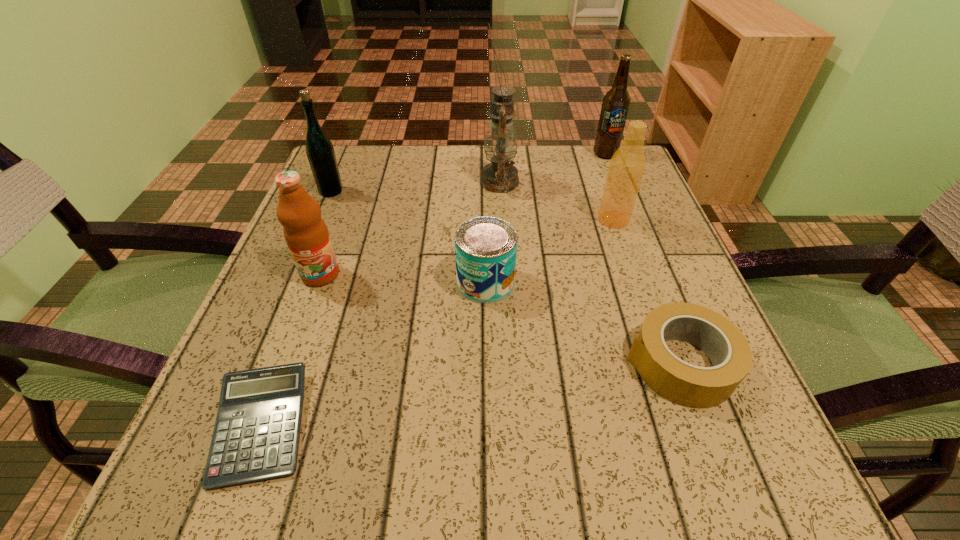
Find the location of `the tallest object`. the tallest object is located at coordinates (501, 142).

Where is `the farthest object`? The height and width of the screenshot is (540, 960). the farthest object is located at coordinates (616, 102).

Where is `the leftmost beer bottle`? the leftmost beer bottle is located at coordinates (320, 152).

You are a GUI agent. You are given a task and a screenshot of the screen. Output one action in this format:
    pyautogui.click(x=<x>, y=<y>)
    Task: Click on the fourth farthest object
    
    Given the screenshot: What is the action you would take?
    pyautogui.click(x=627, y=166)

The height and width of the screenshot is (540, 960). Identify the location of fruit juice. (306, 234).

In order to click on the sixth tallest object in this screenshot , I will do `click(485, 247)`.

Find the location of a particular element. The image size is (960, 540). the seventh tallest object is located at coordinates (685, 384).

Image resolution: width=960 pixels, height=540 pixels. Find the location of `the shortest object`. the shortest object is located at coordinates (256, 435).

Locate an element on the screen. free space located 0.360m on the front of the oil lamp is located at coordinates (508, 328).

What are the coordinates of `free location located 0.130m on the label of the farthest beer bottle` in the screenshot? It's located at (620, 191).